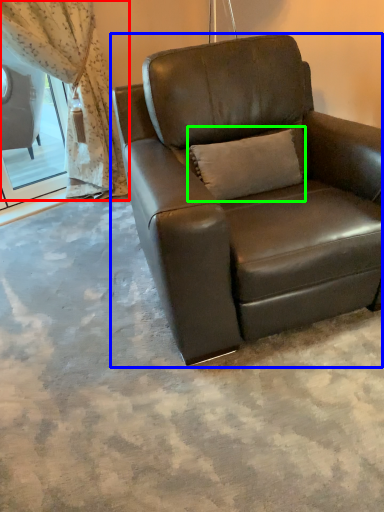
Question: Considering the real-world distances, which object is closest to curtain (highlighted by a red box)? chair (highlighted by a blue box) or pillow (highlighted by a green box).

Choices:
 (A) chair
 (B) pillow

Answer: (A)